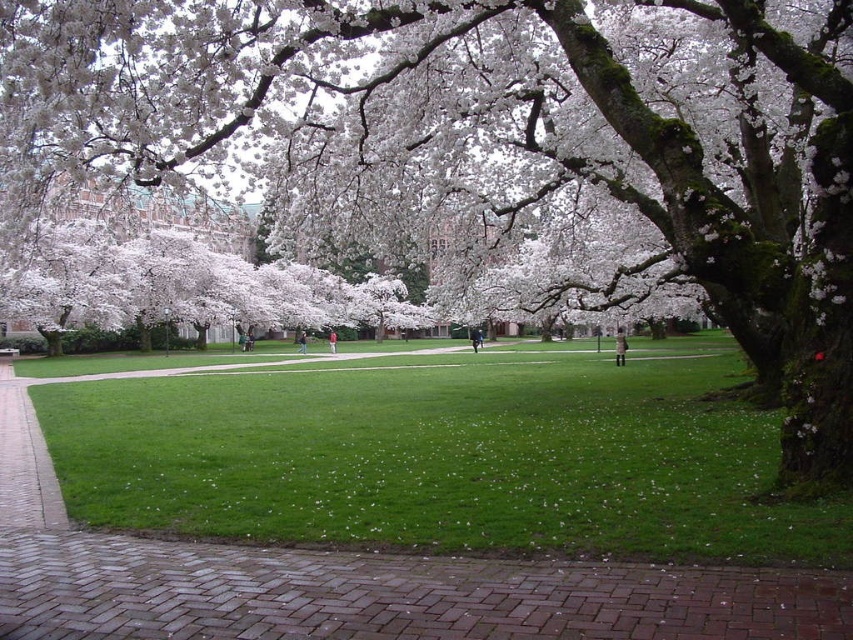
Question: Which object is closer to the camera taking this photo?

Choices:
 (A) brick at lower center
 (B) green grassy field at center

Answer: (A)

Question: Is green grassy field at center further to the viewer compared to brick at lower center?

Choices:
 (A) yes
 (B) no

Answer: (A)

Question: Which object appears farthest from the camera in this image?

Choices:
 (A) brick at lower center
 (B) green grassy field at center

Answer: (B)

Question: Is green grassy field at center bigger than brick at lower center?

Choices:
 (A) no
 (B) yes

Answer: (B)

Question: Can you confirm if green grassy field at center is positioned above brick at lower center?

Choices:
 (A) yes
 (B) no

Answer: (A)

Question: Which point is closer to the camera?

Choices:
 (A) green grassy field at center
 (B) brick at lower center

Answer: (B)